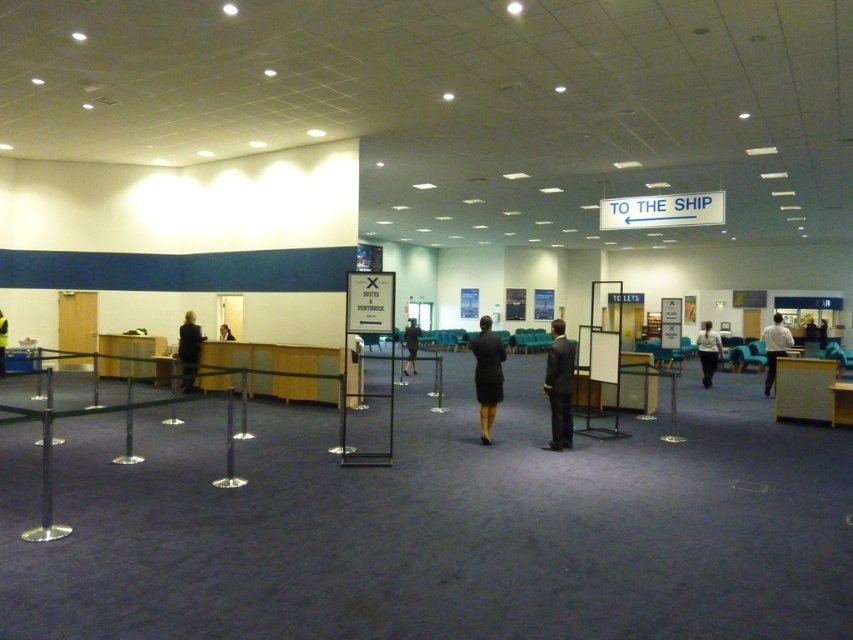
Is light brown wooden desk at center further to camera compared to black suit at center?

No, light brown wooden desk at center is closer to the viewer.

Is light brown wooden desk at center below black suit at center?

Correct, light brown wooden desk at center is located below black suit at center.

Is point (782, 368) closer to viewer compared to point (219, 332)?

Yes, point (782, 368) is closer to viewer.

Find the location of a particular element. light brown wooden desk at center is located at coordinates (804, 388).

Is matte black dress at center to the right of wooden desk at left from the viewer's perspective?

Indeed, matte black dress at center is positioned on the right side of wooden desk at left.

Who is higher up, matte black dress at center or wooden desk at left?

matte black dress at center is higher up.

Who is more distant from viewer, (500,342) or (108,372)?

The point (108,372) is behind.

Locate an element on the screen. Image resolution: width=853 pixels, height=640 pixels. matte black dress at center is located at coordinates (486, 374).

Who is higher up, wooden desk at center or black suit at left?

black suit at left is above.

From the picture: Does wooden desk at center have a lesser height compared to black suit at left?

Indeed, wooden desk at center has a lesser height compared to black suit at left.

Between point (300, 365) and point (180, 337), which one is positioned behind?

Point (180, 337)

At what (x,y) coordinates should I click in order to perform the action: click on wooden desk at center. Please return your answer as a coordinate pair (x, y). Looking at the image, I should click on (271, 369).